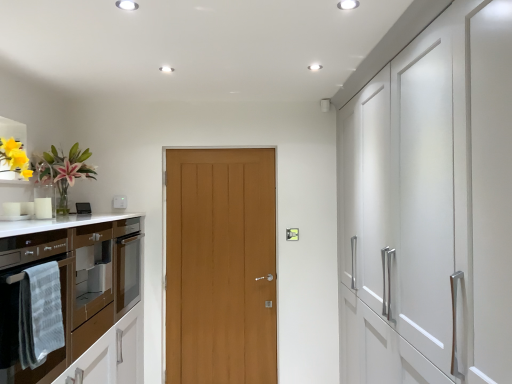
You are a GUI agent. You are given a task and a screenshot of the screen. Output one action in this format:
    pyautogui.click(x=<x>, y=<y>)
    Task: Click on the free space above wooden door at center, the 1th door when ordered from front to back (from a real-world perspective)
    Image resolution: width=512 pixels, height=384 pixels.
    Given the screenshot: What is the action you would take?
    pyautogui.click(x=211, y=146)